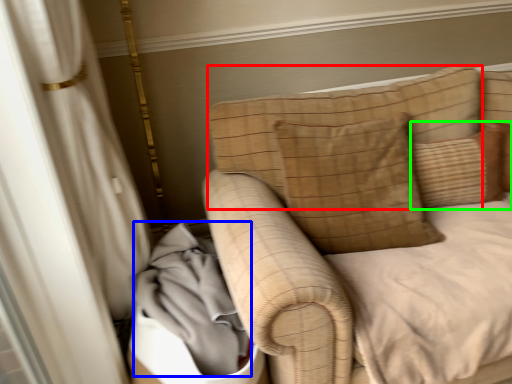
Question: Based on their relative distances, which object is nearer to pillow (highlighted by a red box)? Choose from material (highlighted by a blue box) and pillow (highlighted by a green box).

Choices:
 (A) material
 (B) pillow

Answer: (B)